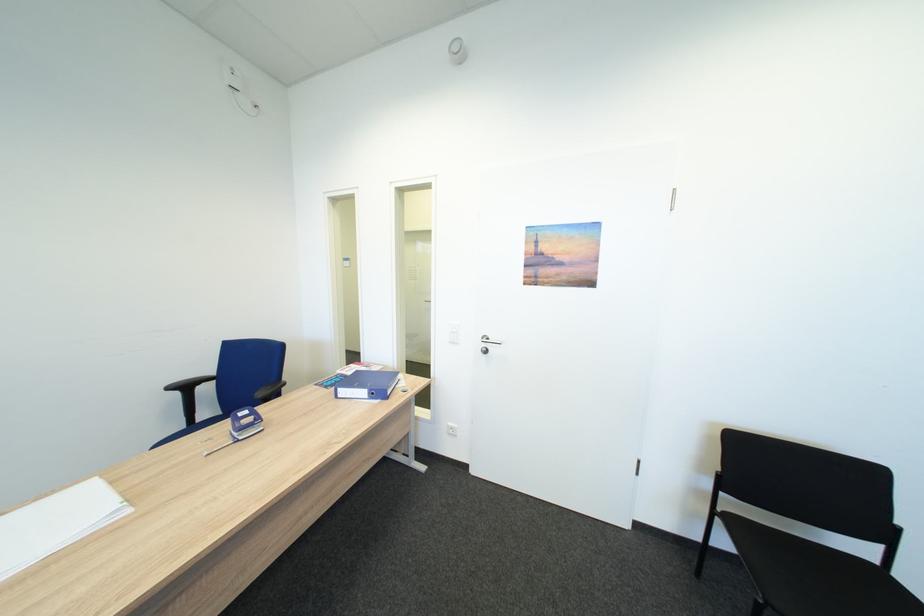
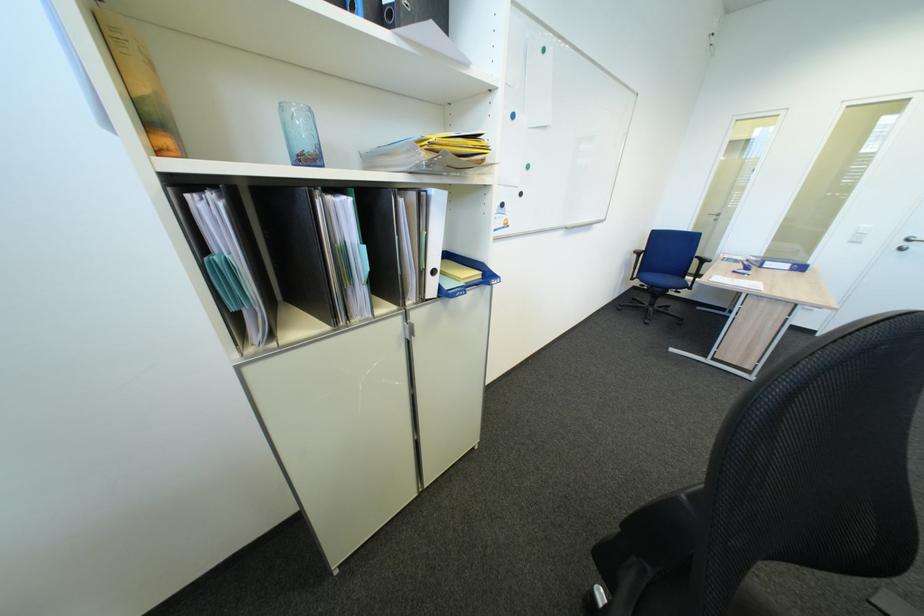
The point at (349, 391) is marked in the first image. Where is the corresponding point in the second image?

(776, 264)